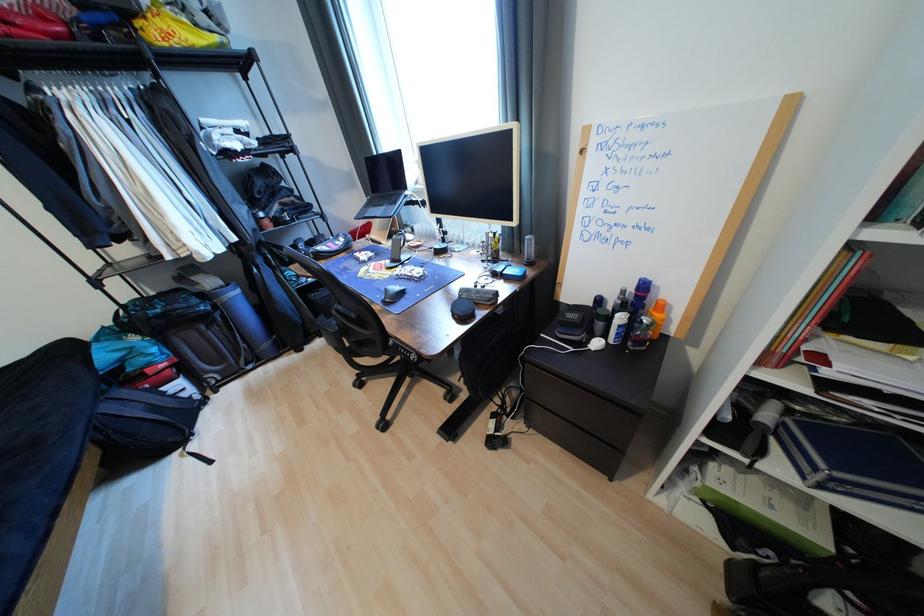
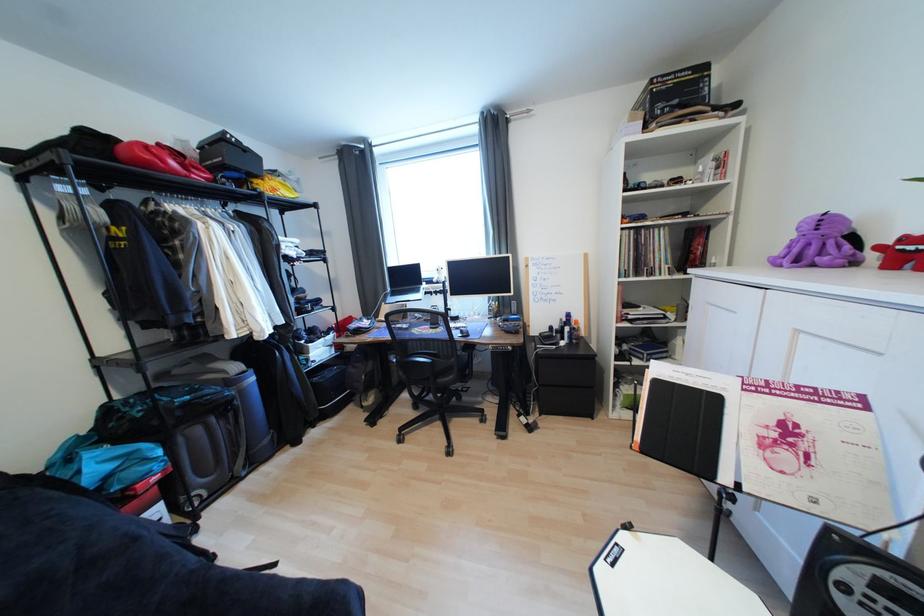
Find the pixel in the second image that matches point (388, 207) in the first image.

(415, 294)